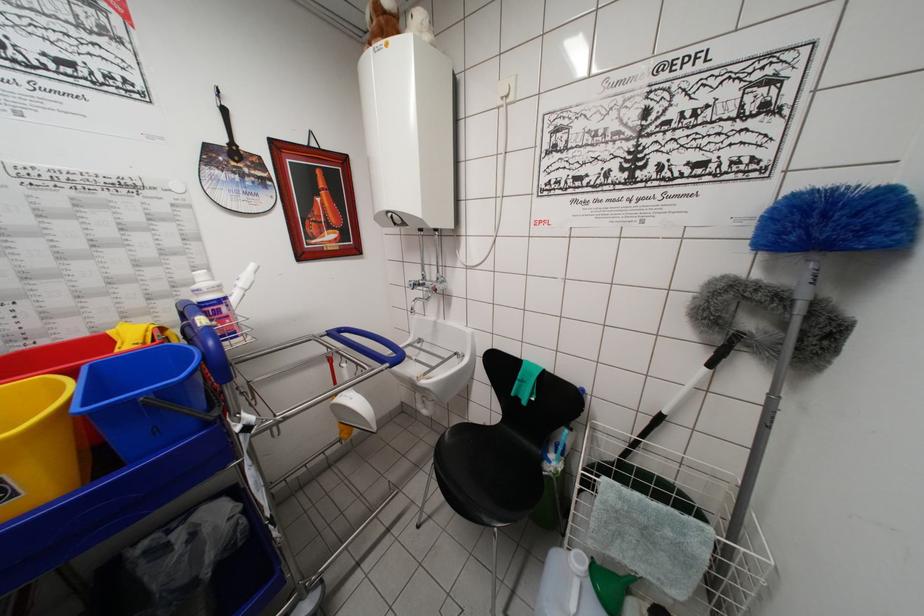
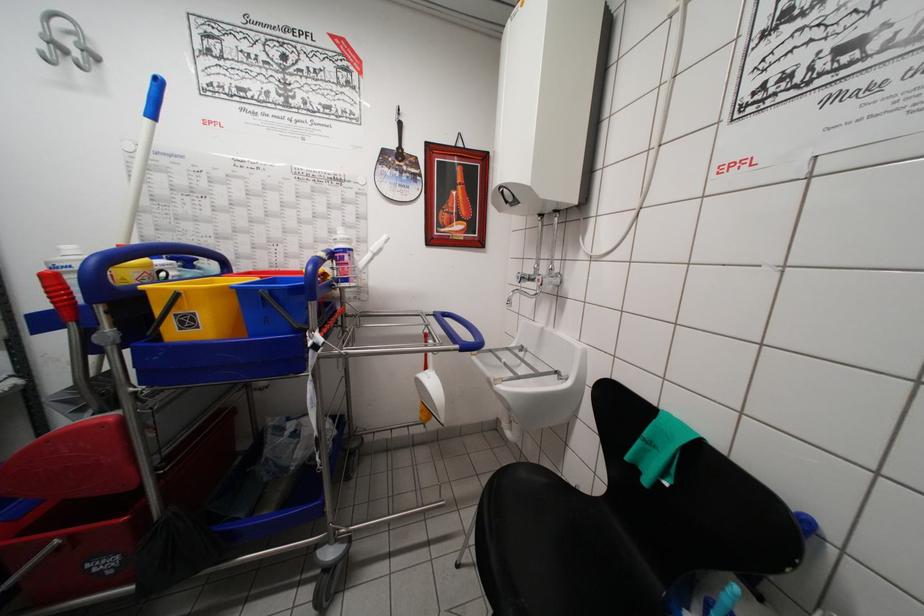
Question: Based on the continuous images, in which direction is the camera rotating? Reply with the corresponding letter.

Choices:
 (A) Left
 (B) Right
 (C) Up
 (D) Down

Answer: (A)